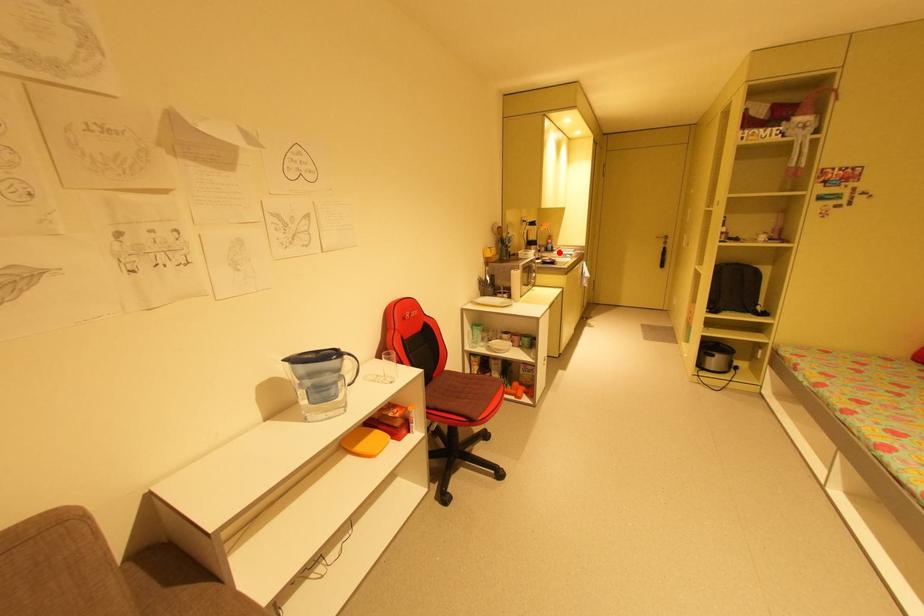
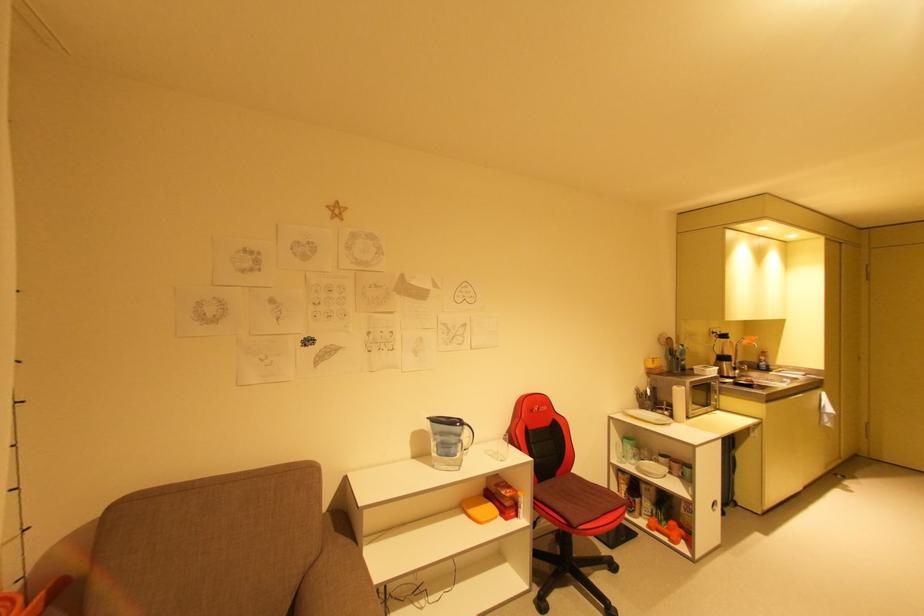
Locate, in the second image, the point that corresponds to the highlighted location in the first image.

(776, 373)